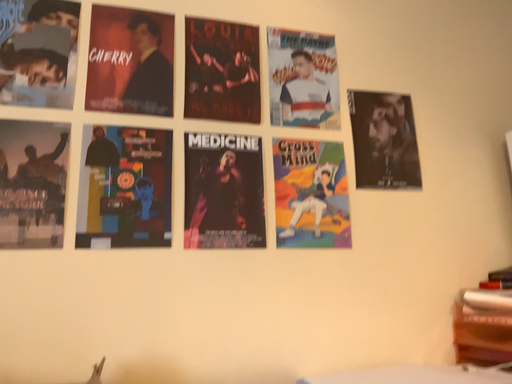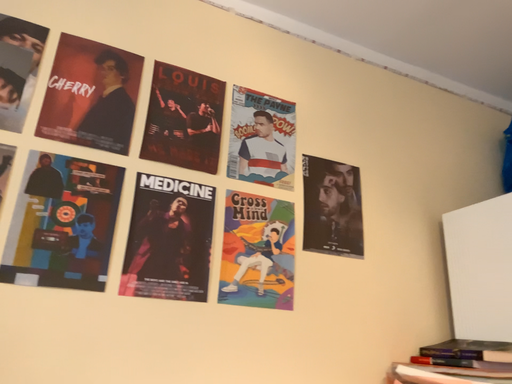
Question: How did the camera likely rotate when shooting the video?

Choices:
 (A) rotated downward
 (B) rotated upward

Answer: (B)